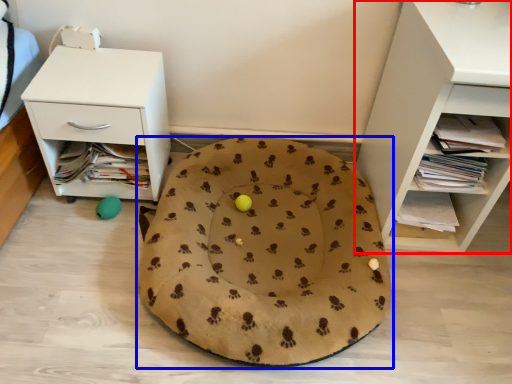
Question: Which object appears farthest to the camera in this image, shelf (highlighted by a red box) or dog bed (highlighted by a blue box)?

Choices:
 (A) shelf
 (B) dog bed

Answer: (B)